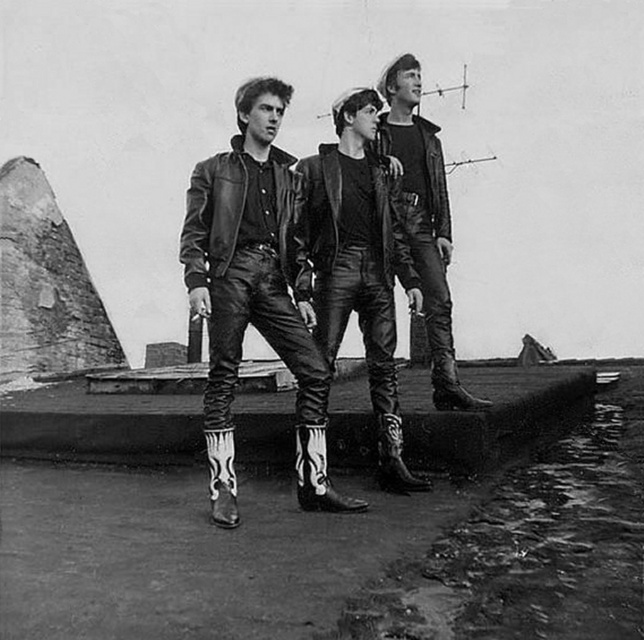
Looking at this image, based on the scene described, which item is positioned closer to the observer between the leather boots at center and the leather pants at center?

The leather boots at center are positioned closer to the observer than the leather pants at center.

Looking at this image, you are a fashion designer analyzing the clothing items in the image. Which clothing item takes up more space visually between the leather pants at center and the leather jacket at center?

The leather jacket at center takes up more space visually than the leather pants at center because the leather pants at center occupies less space than leather jacket at center.